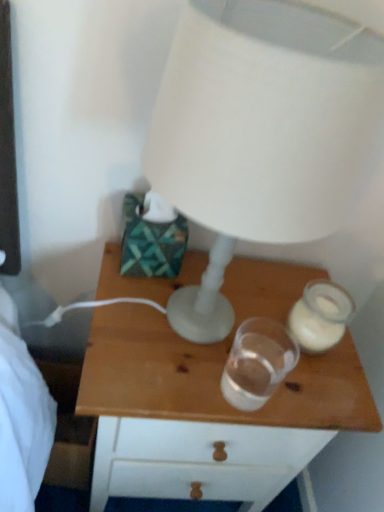
Find the location of a particular element. Image resolution: width=384 pixels, height=512 pixels. vacant space behind translucent glass candle holder at right, the first candle holder in the right-to-left sequence is located at coordinates (277, 283).